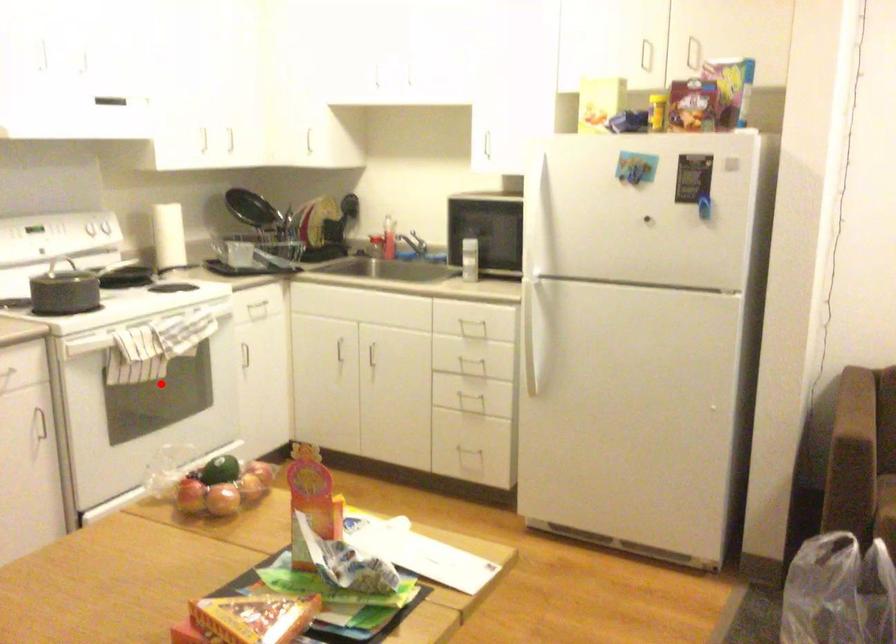
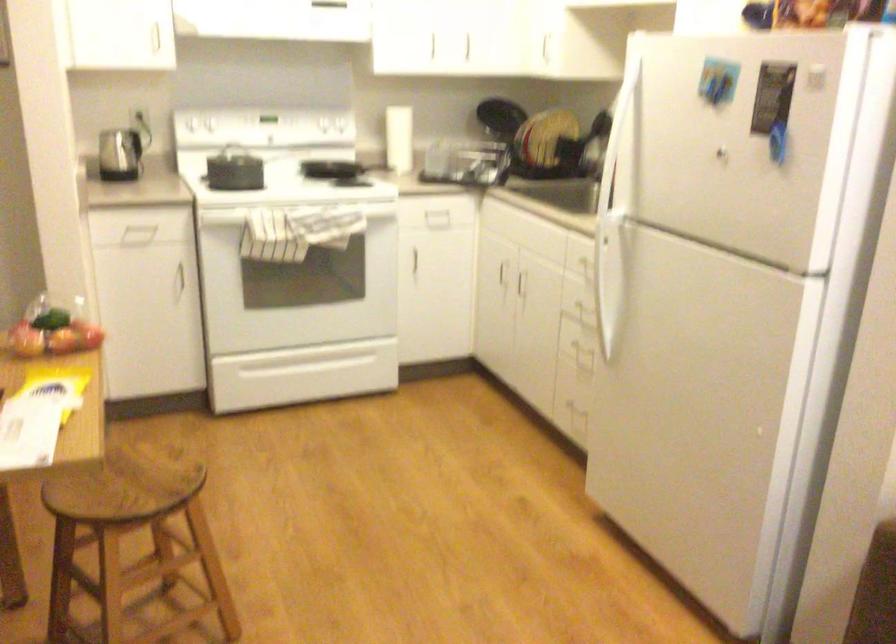
In the second image, find the point that corresponds to the highlighted location in the first image.

(289, 261)